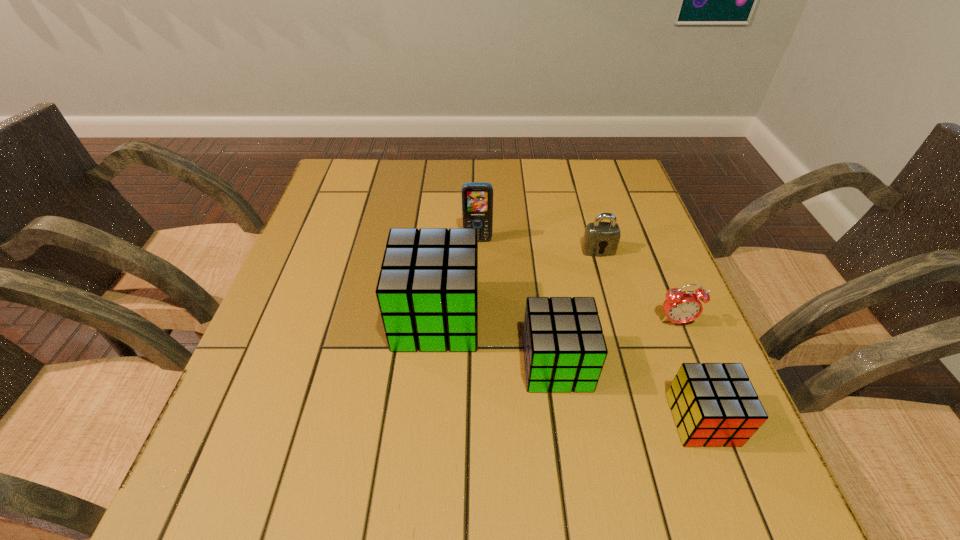
Please point out where to position a new cube on the left to maintain spacing. Please provide its 2D coordinates. Your answer should be formatted as a tuple, i.e. [(x, y)], where the tuple contains the x and y coordinates of a point satisfying the conditions above.

[(335, 280)]